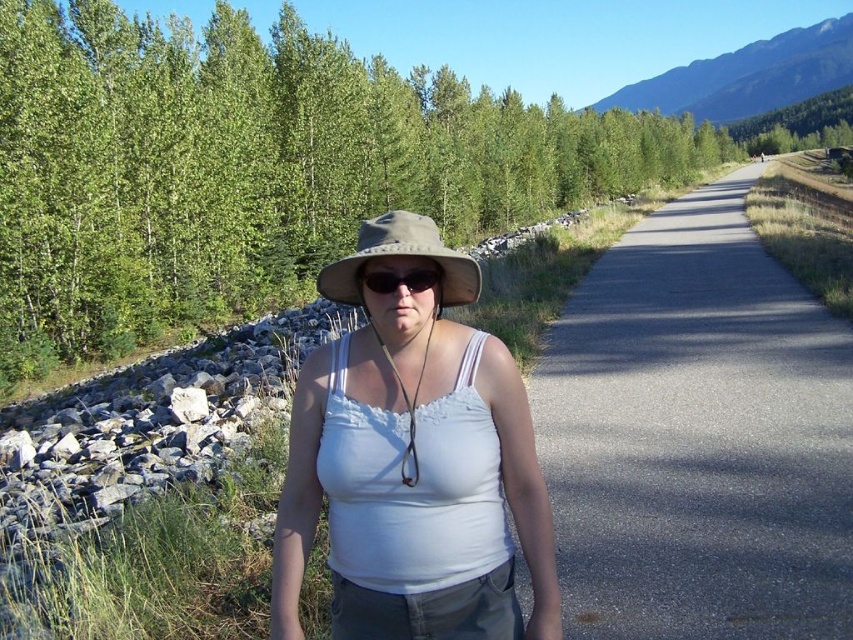
Question: Which of the following is the farthest from the observer?

Choices:
 (A) matte white tank top at center
 (B) tan straw hat at center
 (C) black matte sunglasses at center

Answer: (B)

Question: Is blue rocky mountain at upper right positioned before black matte sunglasses at center?

Choices:
 (A) no
 (B) yes

Answer: (A)

Question: Which point is farther to the camera?

Choices:
 (A) (236, 291)
 (B) (375, 250)
 (C) (630, 381)

Answer: (A)

Question: Does green leafy trees at center come behind matte white tank top at center?

Choices:
 (A) no
 (B) yes

Answer: (B)

Question: Which point appears farthest from the camera in this image?

Choices:
 (A) coord(706,106)
 (B) coord(833,332)

Answer: (A)

Question: Can you confirm if matte white tank top at center is wider than black matte sunglasses at center?

Choices:
 (A) no
 (B) yes

Answer: (B)